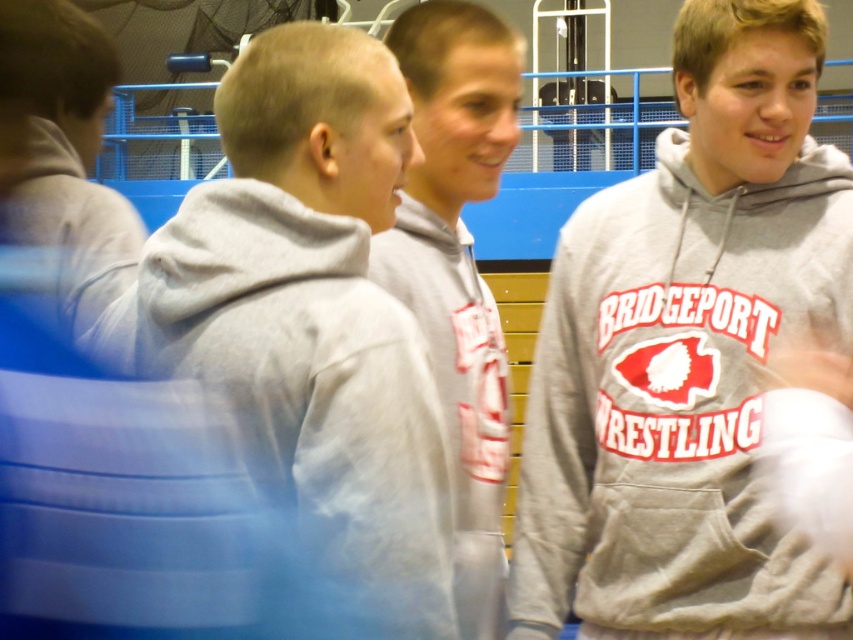
Question: Which point is farther from the camera taking this photo?

Choices:
 (A) (3, 88)
 (B) (189, 196)
 (C) (494, 355)

Answer: (C)

Question: Does gray fleece sweatshirt at center have a larger size compared to gray hoodie at center?

Choices:
 (A) yes
 (B) no

Answer: (A)

Question: Among these objects, which one is nearest to the camera?

Choices:
 (A) gray hoodie at left
 (B) gray hoodie at center
 (C) gray matte hoodie at center
 (D) gray fleece sweatshirt at center

Answer: (C)

Question: Which object is positioned closest to the gray hoodie at left?

Choices:
 (A) gray hoodie at center
 (B) gray fleece sweatshirt at center
 (C) gray matte hoodie at center

Answer: (C)

Question: Where is gray fleece sweatshirt at center located in relation to gray hoodie at center in the image?

Choices:
 (A) above
 (B) below

Answer: (B)

Question: Is gray fleece sweatshirt at center to the right of gray hoodie at left from the viewer's perspective?

Choices:
 (A) no
 (B) yes

Answer: (B)